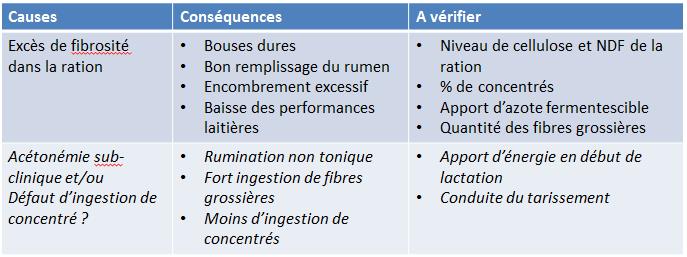
Where is `middle column`? The width and height of the screenshot is (687, 257). middle column is located at coordinates (374, 126), (378, 214).